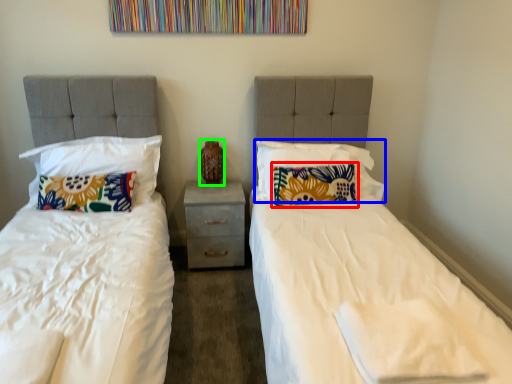
Question: Which is farther away from pillow (highlighted by a red box)? pillow (highlighted by a blue box) or vase (highlighted by a green box)?

Choices:
 (A) pillow
 (B) vase

Answer: (B)